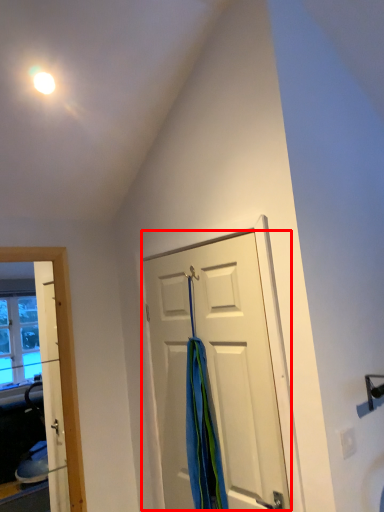
Question: In this image, where is door (annotated by the red box) located relative to shower curtain?

Choices:
 (A) left
 (B) right

Answer: (B)